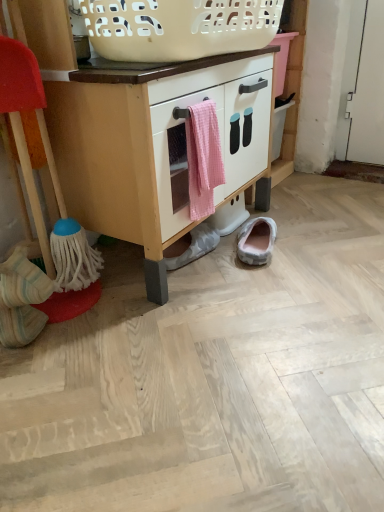
Question: Is point (147, 180) closer or farther from the camera than point (276, 12)?

Choices:
 (A) closer
 (B) farther

Answer: (A)

Question: In the image, is white matte cabinet at center positioned in front of or behind white plastic basket at upper center?

Choices:
 (A) front
 (B) behind

Answer: (B)

Question: Which object is positioned farthest from the white matte cabinet at center?

Choices:
 (A) white striped socks at lower left, which ranks as the third footwear in back-to-front order
 (B) gray fabric slipper at lower center, positioned as the second footwear in front-to-back order
 (C) pink gingham towel at center
 (D) white plastic basket at upper center
 (E) gray suede slipper at lower center, positioned as the 1th footwear in back-to-front order

Answer: (A)

Question: Based on their relative distances, which object is nearer to the white striped socks at lower left, which is the 1th footwear in left-to-right order?

Choices:
 (A) gray suede slipper at lower center, acting as the third footwear starting from the left
 (B) gray fabric slipper at lower center, placed as the 2th footwear when sorted from left to right
 (C) white plastic basket at upper center
 (D) white matte cabinet at center
 (E) pink gingham towel at center

Answer: (E)